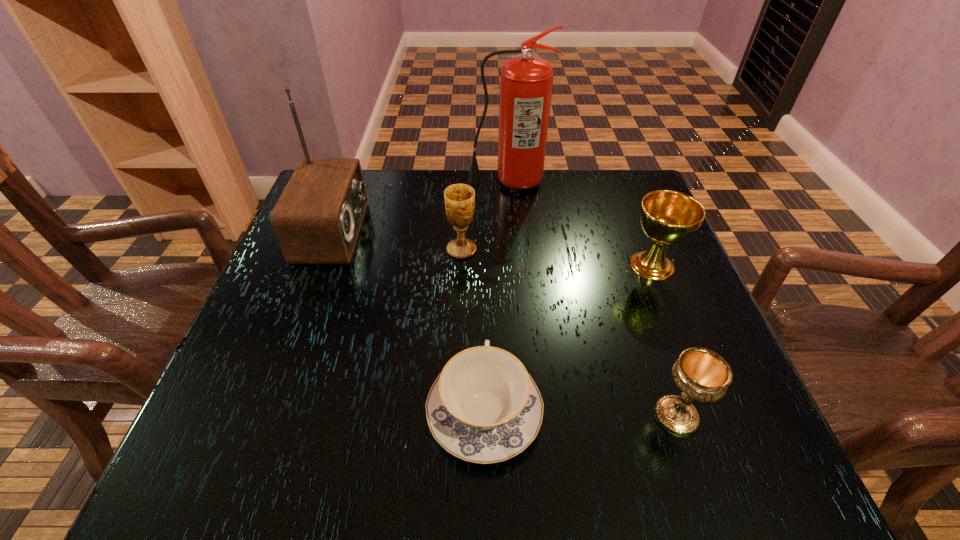
Locate an element on the screen. This screenshot has width=960, height=540. free space that satisfies the following two spatial constraints: 1. on the back side of the leftmost chalice; 2. on the front-facing side of the leftmost object is located at coordinates (463, 232).

Where is `free space that satisfies the following two spatial constraints: 1. on the front-facing side of the leftmost chalice; 2. on the right side of the leftmost object`? free space that satisfies the following two spatial constraints: 1. on the front-facing side of the leftmost chalice; 2. on the right side of the leftmost object is located at coordinates (327, 249).